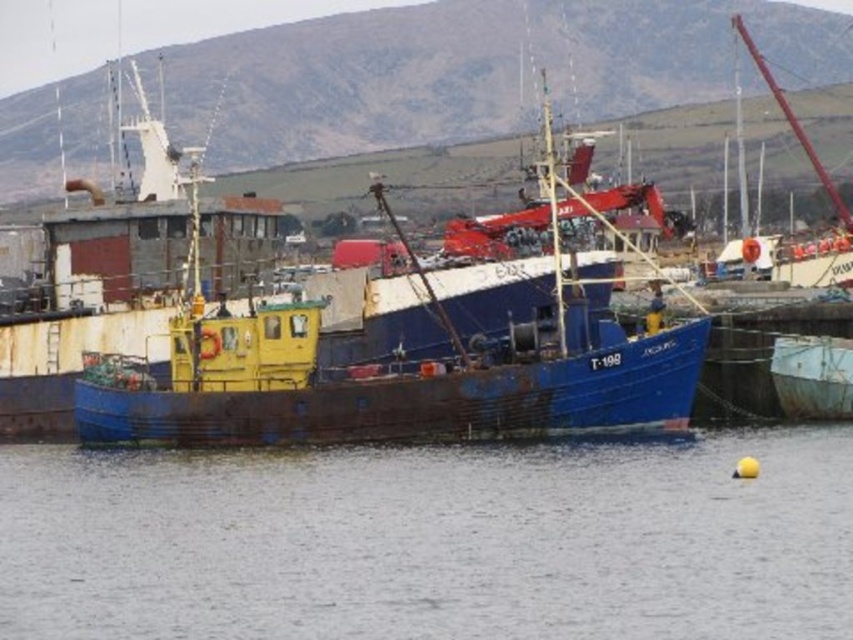
Which of these two, transparent water at center or rusty metal boat at lower right, stands taller?

Standing taller between the two is transparent water at center.

Who is positioned more to the right, transparent water at center or rusty metal boat at lower right?

rusty metal boat at lower right is more to the right.

Identify the location of transparent water at center. (432, 541).

Where is `transparent water at center`? This screenshot has height=640, width=853. transparent water at center is located at coordinates (432, 541).

Does point (376, 428) lie in front of point (811, 362)?

Yes, point (376, 428) is in front of point (811, 362).

Does rusty metal boat at center have a lesser width compared to rusty metal boat at lower right?

No, rusty metal boat at center is not thinner than rusty metal boat at lower right.

Between point (216, 426) and point (840, 380), which one is positioned in front?

Point (216, 426) is more forward.

The height and width of the screenshot is (640, 853). What are the coordinates of `rusty metal boat at center` in the screenshot? It's located at (393, 376).

Is transparent water at center thinner than rusty metal boat at center?

No.

Who is positioned more to the right, transparent water at center or rusty metal boat at center?

rusty metal boat at center is more to the right.

Does point (383, 554) lie in front of point (196, 291)?

Yes.

Where is `transparent water at center`? Image resolution: width=853 pixels, height=640 pixels. transparent water at center is located at coordinates (432, 541).